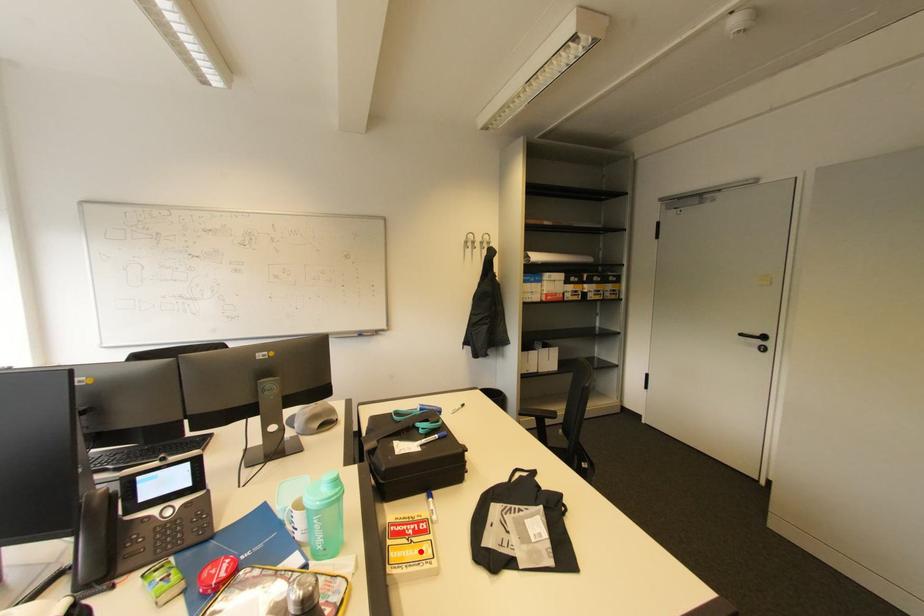
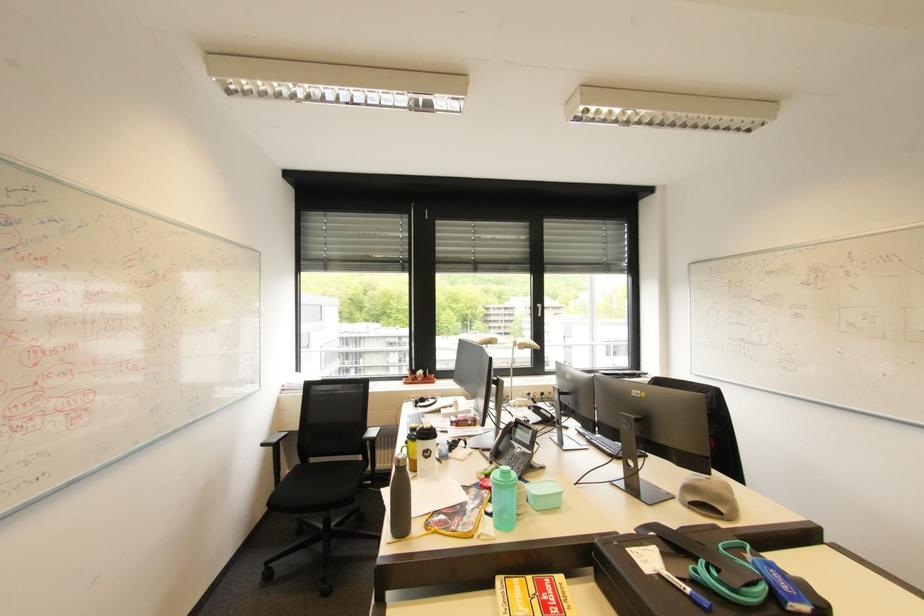
The point at the highlighted location is marked in the first image. Where is the corresponding point in the second image?

(526, 602)